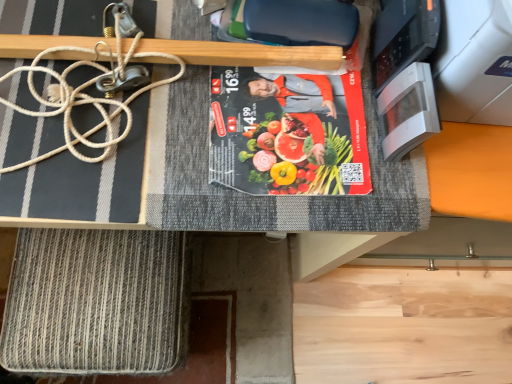
Question: Is rope-like textured mat at lower left at the left side of wooden at upper center?

Choices:
 (A) no
 (B) yes

Answer: (B)

Question: From the image's perspective, would you say rope-like textured mat at lower left is shown under wooden at upper center?

Choices:
 (A) no
 (B) yes

Answer: (B)

Question: Can you confirm if rope-like textured mat at lower left is taller than wooden at upper center?

Choices:
 (A) no
 (B) yes

Answer: (B)

Question: From a real-world perspective, is rope-like textured mat at lower left located beneath wooden at upper center?

Choices:
 (A) no
 (B) yes

Answer: (B)

Question: Is wooden at upper center at the back of rope-like textured mat at lower left?

Choices:
 (A) no
 (B) yes

Answer: (A)

Question: Looking at their shapes, would you say wooden at upper center is wider or thinner than white rope at upper left?

Choices:
 (A) thin
 (B) wide

Answer: (A)

Question: Is wooden at upper center bigger or smaller than white rope at upper left?

Choices:
 (A) small
 (B) big

Answer: (A)

Question: From the image's perspective, is wooden at upper center positioned above or below white rope at upper left?

Choices:
 (A) below
 (B) above

Answer: (A)

Question: Is wooden at upper center inside or outside of white rope at upper left?

Choices:
 (A) inside
 (B) outside

Answer: (B)

Question: Is wooden at upper center situated inside matte black book at center or outside?

Choices:
 (A) inside
 (B) outside

Answer: (B)

Question: From the image's perspective, is wooden at upper center positioned above or below matte black book at center?

Choices:
 (A) above
 (B) below

Answer: (A)

Question: Looking at the image, does wooden at upper center seem bigger or smaller compared to matte black book at center?

Choices:
 (A) big
 (B) small

Answer: (B)

Question: In the image, is wooden at upper center positioned in front of or behind matte black book at center?

Choices:
 (A) behind
 (B) front

Answer: (B)

Question: Is point (420, 122) positioned closer to the camera than point (337, 132)?

Choices:
 (A) closer
 (B) farther

Answer: (A)

Question: In terms of size, does white glossy microwave at upper right appear bigger or smaller than matte black book at center?

Choices:
 (A) small
 (B) big

Answer: (A)